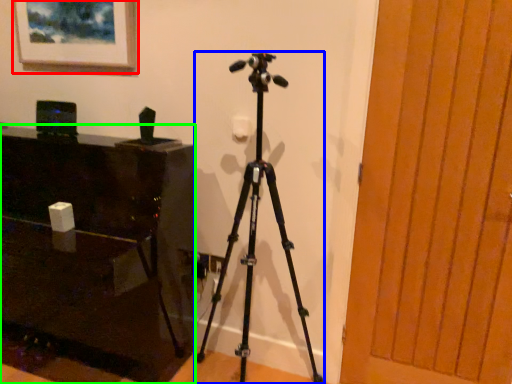
Question: Estimate the real-world distances between objects in this image. Which object is farther from picture frame (highlighted by a red box), tripod (highlighted by a blue box) or furniture (highlighted by a green box)?

Choices:
 (A) tripod
 (B) furniture

Answer: (A)